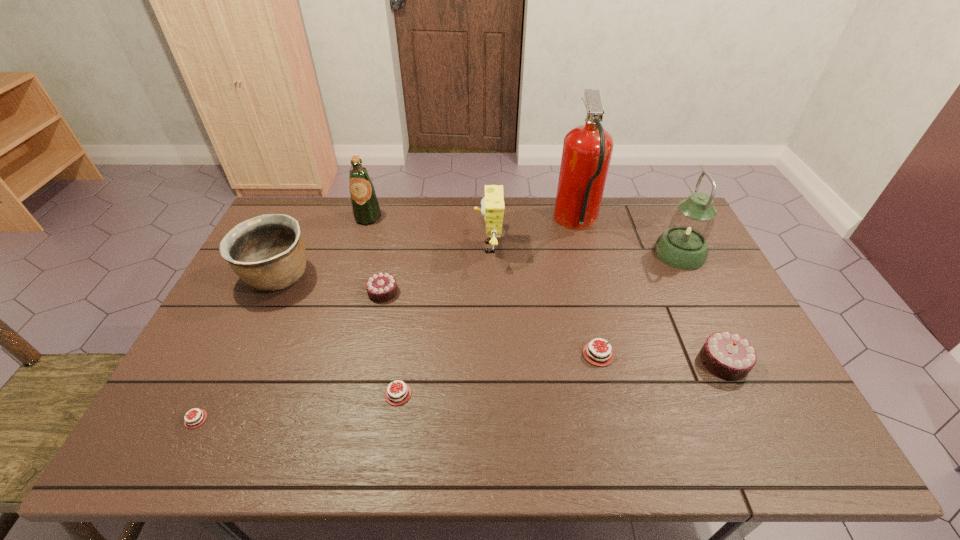
The width and height of the screenshot is (960, 540). I want to click on vacant space located 0.100m with the handle and nozzle on the red fire extinguisher, so click(x=527, y=223).

The width and height of the screenshot is (960, 540). What are the coordinates of `vacant space located 0.160m with the handle and nozzle on the red fire extinguisher` in the screenshot? It's located at (510, 223).

Locate an element on the screen. This screenshot has width=960, height=540. blank area located 0.240m on the back of the lantern is located at coordinates (653, 198).

The height and width of the screenshot is (540, 960). Find the location of `vacant region located 0.350m on the front-facing side of the olive oil`. vacant region located 0.350m on the front-facing side of the olive oil is located at coordinates (344, 299).

Locate an element on the screen. The height and width of the screenshot is (540, 960). free space located on the front-facing side of the sixth object from left to right is located at coordinates (364, 247).

Locate an element on the screen. This screenshot has height=540, width=960. free space located on the front-facing side of the sixth object from left to right is located at coordinates (402, 247).

What are the coordinates of `vacant space located 0.360m on the front-facing side of the sixth object from left to right` in the screenshot? It's located at (367, 247).

Image resolution: width=960 pixels, height=540 pixels. What are the coordinates of `free point located on the front of the sixth shortest object` in the screenshot? It's located at click(221, 399).

Locate an element on the screen. The width and height of the screenshot is (960, 540). vacant point located 0.240m on the left of the nearer chocolate chocolate cake is located at coordinates (608, 362).

Where is `vacant space located on the left of the farther chocolate chocolate cake`? vacant space located on the left of the farther chocolate chocolate cake is located at coordinates click(x=264, y=292).